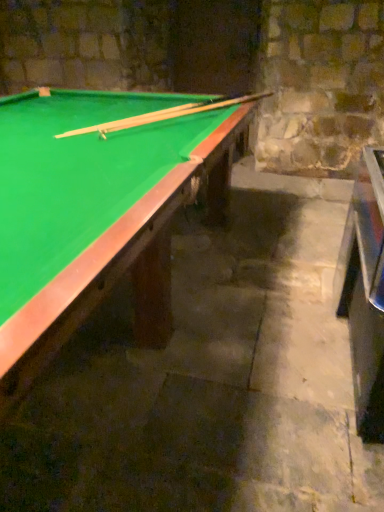
Question: Considering the positions of point (59, 174) and point (132, 124), is point (59, 174) closer or farther from the camera than point (132, 124)?

Choices:
 (A) farther
 (B) closer

Answer: (B)

Question: From the image's perspective, is green felt billiard table at upper left located above or below wooden cue at upper center?

Choices:
 (A) above
 (B) below

Answer: (B)

Question: Which object is the closest to the wooden cue at upper center?

Choices:
 (A) metallic silver table at right
 (B) green felt billiard table at upper left

Answer: (B)

Question: Estimate the real-world distances between objects in this image. Which object is farther from the green felt billiard table at upper left?

Choices:
 (A) metallic silver table at right
 (B) wooden cue at upper center

Answer: (A)